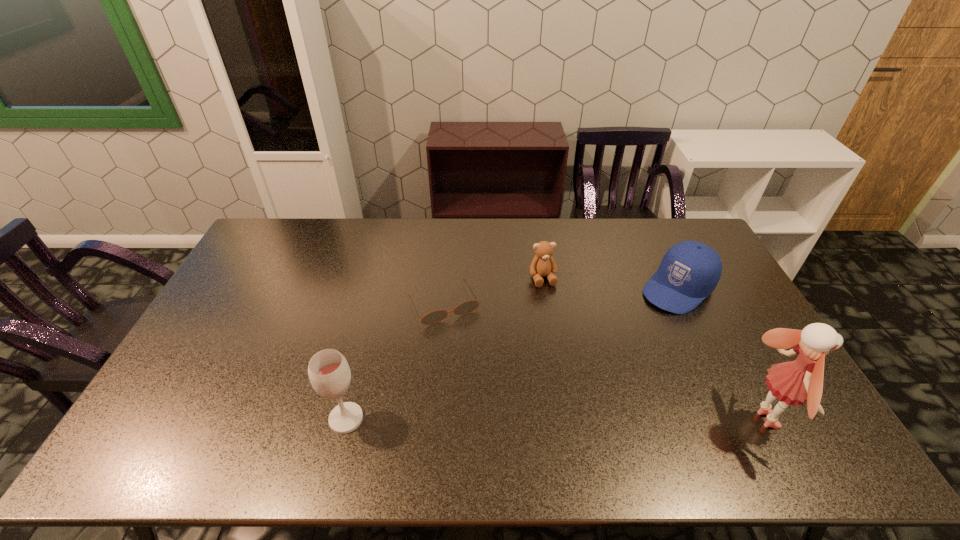
Image resolution: width=960 pixels, height=540 pixels. What are the coordinates of `doll located at the right edge` in the screenshot? It's located at (795, 382).

Where is `cap at the right edge`? cap at the right edge is located at coordinates (689, 272).

Where is `object situated at the near right corner`? object situated at the near right corner is located at coordinates (795, 382).

In the image, there is a desktop. At what (x,y) coordinates should I click in order to perform the action: click on vacant region at the far edge. Please return your answer as a coordinate pair (x, y). Looking at the image, I should click on (441, 255).

At what (x,y) coordinates should I click in order to perform the action: click on vacant space at the near edge of the desktop. Please return your answer as a coordinate pair (x, y). Looking at the image, I should click on (564, 395).

The height and width of the screenshot is (540, 960). In the image, there is a desktop. What are the coordinates of `vacant space at the left edge` in the screenshot? It's located at (215, 384).

Identify the location of free region at the right edge of the desktop. This screenshot has width=960, height=540. (745, 375).

This screenshot has height=540, width=960. I want to click on free point at the far right corner, so click(692, 224).

Locate an element on the screen. vacant point located between the shortest object and the wineglass is located at coordinates (395, 361).

This screenshot has height=540, width=960. In order to click on vacant space in between the tallest object and the fourth shortest object in this screenshot , I will do `click(554, 419)`.